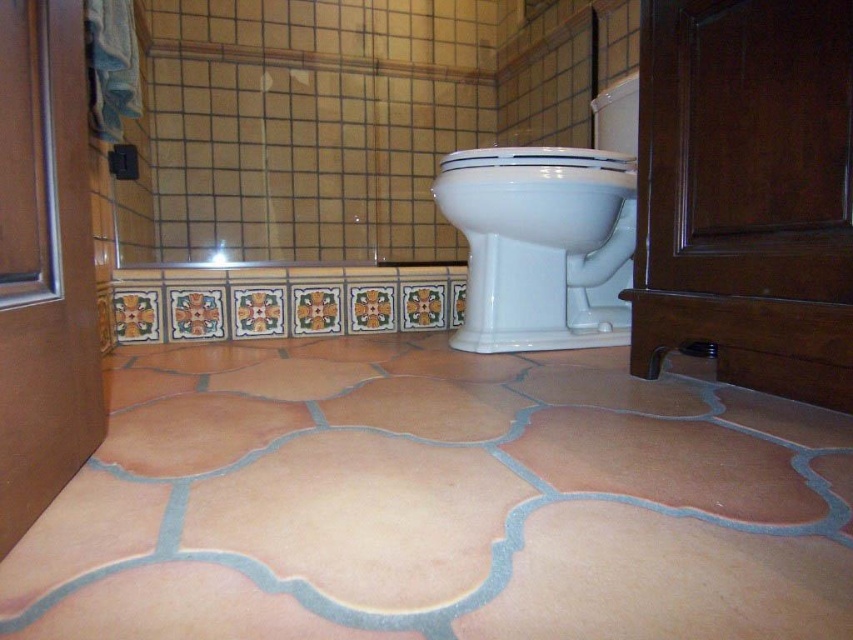
Question: Which object is farther from the camera taking this photo?

Choices:
 (A) white glossy toilet bowl at center
 (B) terracotta textured tile at center

Answer: (A)

Question: Can you confirm if terracotta textured tile at center is smaller than white glossy toilet bowl at center?

Choices:
 (A) yes
 (B) no

Answer: (B)

Question: Does terracotta textured tile at center appear under white glossy toilet bowl at center?

Choices:
 (A) no
 (B) yes

Answer: (B)

Question: Which object is farther from the camera taking this photo?

Choices:
 (A) terracotta textured tile at center
 (B) white glossy toilet bowl at center

Answer: (B)

Question: Does terracotta textured tile at center have a greater width compared to white glossy toilet bowl at center?

Choices:
 (A) yes
 (B) no

Answer: (A)